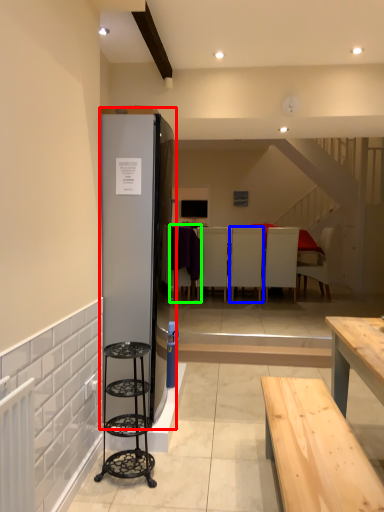
Question: Which is farther away from fridge (highlighted by a red box)? armchair (highlighted by a blue box) or armchair (highlighted by a green box)?

Choices:
 (A) armchair
 (B) armchair

Answer: (A)